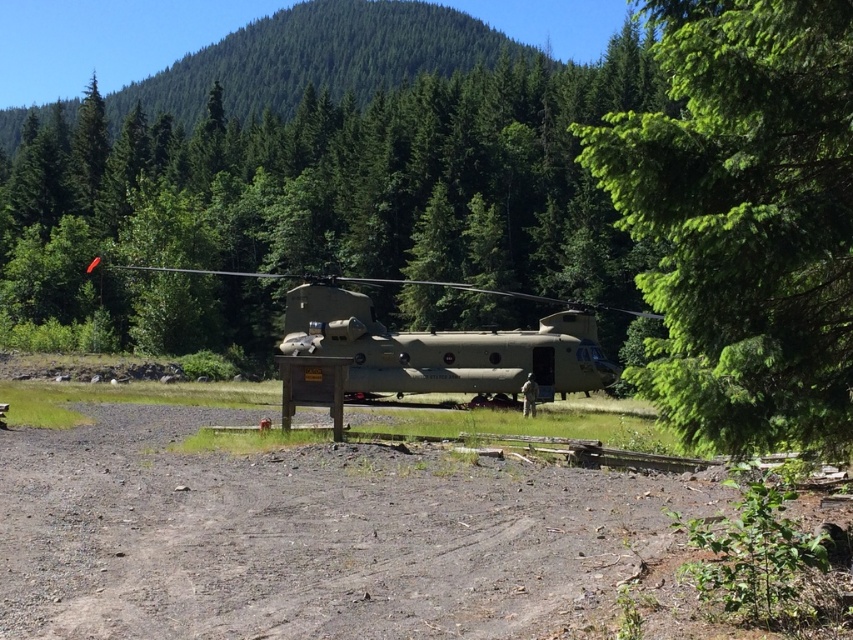
You are a pilot trying to land your matte green helicopter at center in a forest clearing. There is a green leafy tree at center nearby. Based on the scene, will the tree interfere with your landing path?

The green leafy tree at center is positioned on the right side of the matte green helicopter at center, so it may interfere with the landing path depending on the helicopter size and the tree proximity. However, since both are at center, careful maneuvering might be required to avoid collision.

You are a military engineer tasked with transporting a 12.5 feet long cargo container from the dirt path to the helicopter. The container must be placed precisely between the dull brown dirt at center and the helicopter. Is the distance sufficient for this operation?

The distance between the dull brown dirt at center and the helicopter is 15.10 feet. Since the cargo container is 12.5 feet long, there is enough space to place it between them as the available distance exceeds the container length.

You are a drone operator trying to land a small drone on the dirt path near the helicopter. The drone has a GPS coordinate system where the bottom left corner of the image is the origin point. The helicopter is located at point 0.6, 0.4. Can you determine if the point (317, 536) is on the dirt path leading towards the helicopter?

The point (317, 536) corresponds to the dull brown dirt at center, which is part of the dirt path leading towards the helicopter. Since the helicopter is at 0.6, 0.4 and the point in question is (317, 536), this location is along the path towards the helicopter.